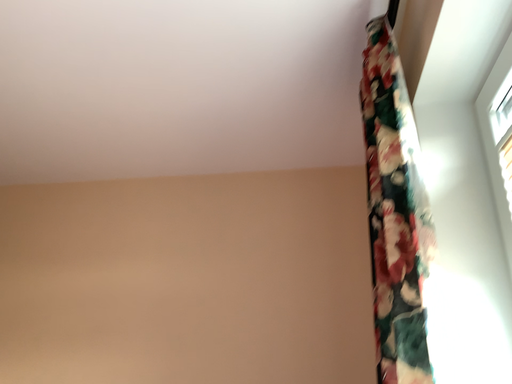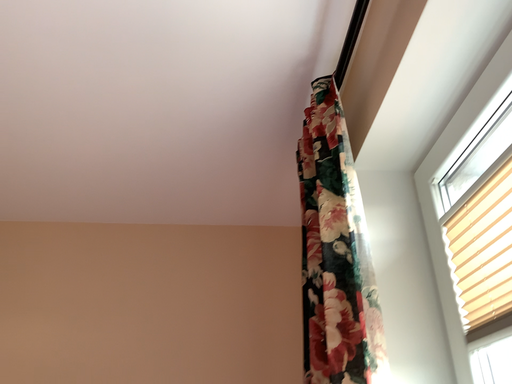
Question: How did the camera likely rotate when shooting the video?

Choices:
 (A) rotated left
 (B) rotated right

Answer: (B)